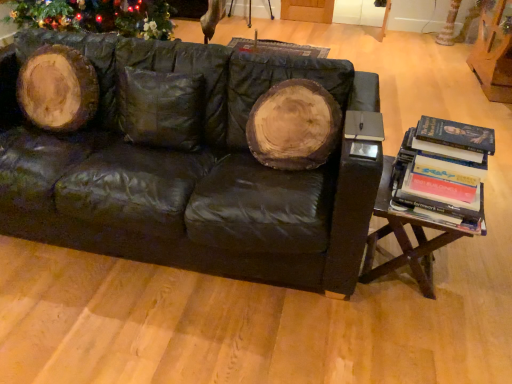
I want to click on vacant space underneath white textured tree trunk at upper right (from a real-world perspective), so click(x=443, y=46).